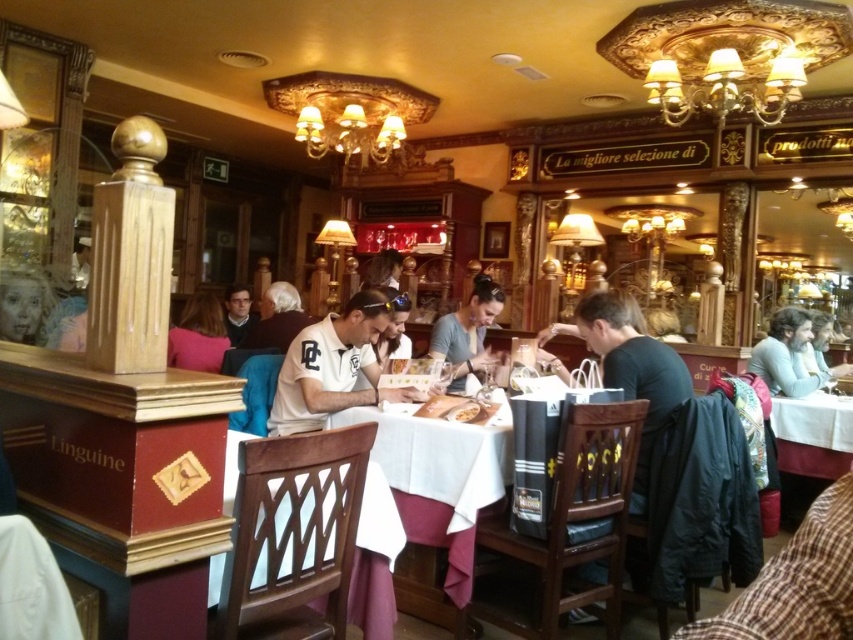
Does light blue sweater at right have a greater height compared to pink fabric at center?

Yes.

Does light blue sweater at right have a lesser width compared to pink fabric at center?

No.

Describe the element at coordinates (786, 355) in the screenshot. I see `light blue sweater at right` at that location.

In order to click on light blue sweater at right in this screenshot , I will do `click(786, 355)`.

Is point (755, 113) positioned behind point (817, 419)?

Yes, point (755, 113) is behind point (817, 419).

Does gold textured chandelier at upper center come behind white cloth table at lower right?

Yes, it is behind white cloth table at lower right.

Does point (718, 83) come in front of point (827, 476)?

No.

Locate an element on the screen. The image size is (853, 640). gold textured chandelier at upper center is located at coordinates (724, 86).

Does gold textured chandelier at upper center have a greater width compared to matte gray shirt at center?

Correct, the width of gold textured chandelier at upper center exceeds that of matte gray shirt at center.

Who is positioned more to the left, gold textured chandelier at upper center or matte gray shirt at center?

Positioned to the left is matte gray shirt at center.

What do you see at coordinates (724, 86) in the screenshot? This screenshot has height=640, width=853. I see `gold textured chandelier at upper center` at bounding box center [724, 86].

Find the location of a particular element. gold textured chandelier at upper center is located at coordinates (724, 86).